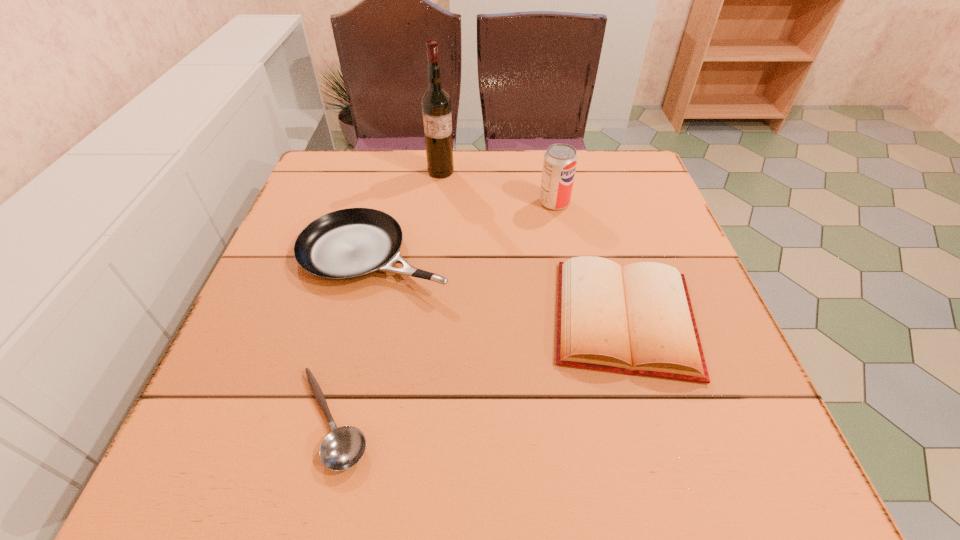
Image resolution: width=960 pixels, height=540 pixels. I want to click on vacant area at the near edge, so coord(397,474).

Identify the location of vacant space at the left edge of the desktop. (281, 238).

Image resolution: width=960 pixels, height=540 pixels. Find the location of `free space at the right edge of the desktop`. free space at the right edge of the desktop is located at coordinates (688, 261).

The width and height of the screenshot is (960, 540). I want to click on blank space at the far left corner of the desktop, so click(358, 183).

I want to click on vacant space at the near left corner of the desktop, so click(x=252, y=442).

At what (x,y) coordinates should I click in order to perform the action: click on free space at the far right corner. Please return your answer as a coordinate pair (x, y). This screenshot has width=960, height=540. Looking at the image, I should click on (632, 187).

Locate an element on the screen. free spot between the second shortest object and the third shortest object is located at coordinates (x=500, y=287).

Identify the location of unoccupied area between the shortest object and the wine bottle. (387, 295).

Identify the location of free space between the shortest object and the third shortest object. This screenshot has width=960, height=540. (354, 337).

Locate an element on the screen. The height and width of the screenshot is (540, 960). free space between the wine bottle and the Bible is located at coordinates (533, 245).